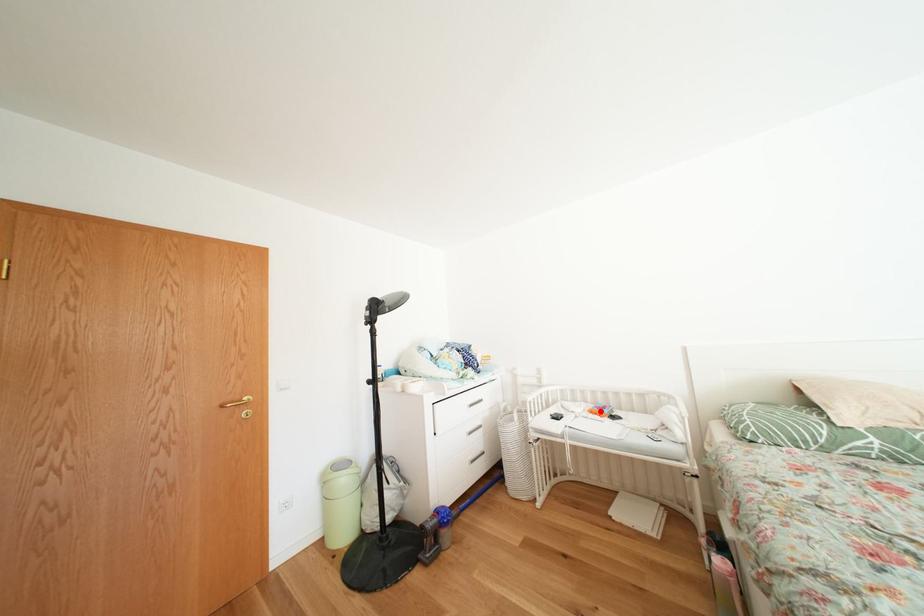
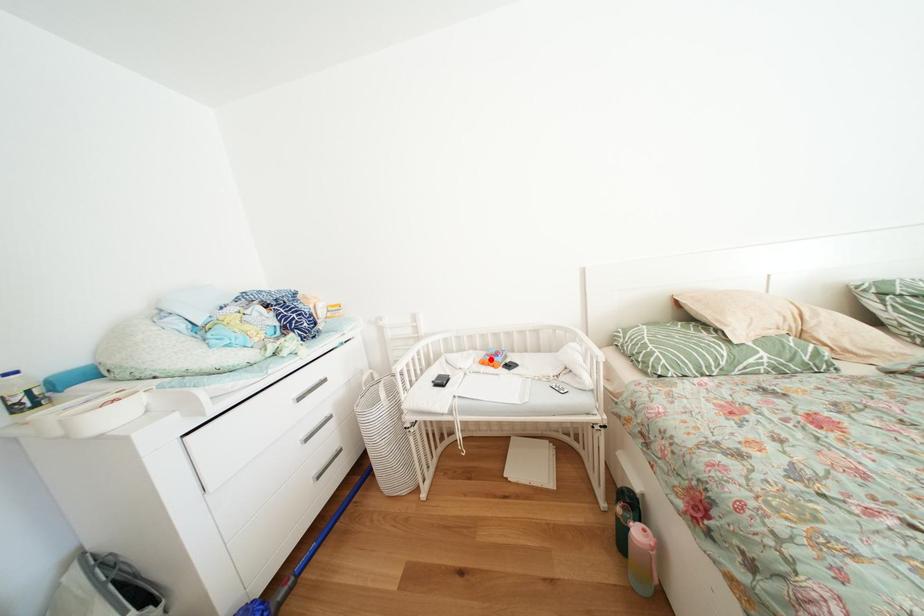
I am providing you with two images of the same scene from different viewpoints. A red point is marked on the first image and another point is marked on the second image. Are the points marked in image1 and image2 representing the same 3D position?

Yes